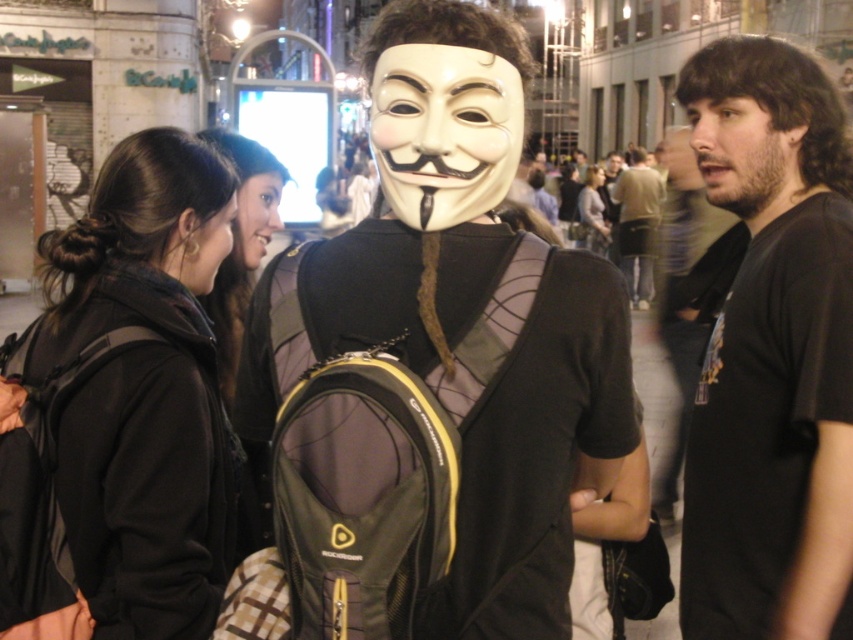
You are a photographer trying to capture a clear shot of the dark brown hair at center and the matte gray hoodie at center. Which object is positioned lower in the frame?

The dark brown hair at center is located below matte gray hoodie at center, so it is positioned lower in the frame.

You are a photographer standing at the edge of the crowd. You want to take a photo that includes both the black fabric jacket at left and the bearded man at center. What is the minimum distance you need to move backward to ensure both subjects are in frame?

The black fabric jacket at left and bearded man at center are 5.13 meters apart. To include both in the frame, you need to move back at least 5.13 meters so that the camera can capture the entire distance between them.

You are a photographer standing at the camera position. You want to capture a clear photo of the matte black backpack at center without any people blocking it. The nearest person to the backpack is 3 feet away from it. Can you move closer to the backpack to take the photo?

The distance between the matte black backpack at center and the camera is 16.99 feet. Since the nearest person is only 3 feet away from the backpack, moving closer might bring you too near to the people nearby, potentially causing obstruction. To ensure a clear shot without people blocking, you should adjust your angle or use a zoom lens instead of moving closer.